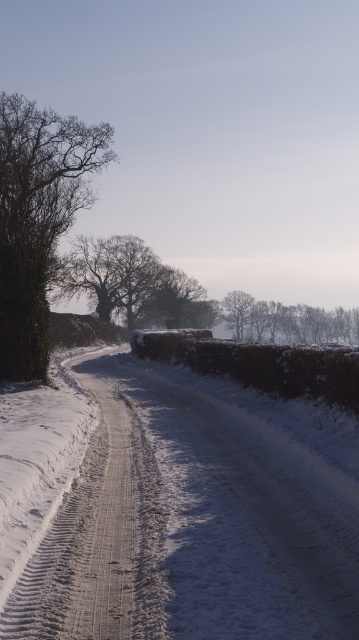
Question: Which object is closer to the camera taking this photo?

Choices:
 (A) green leafy hedge at center
 (B) snowy asphalt road at center

Answer: (B)

Question: Which point is farther from the camera taking this photo?

Choices:
 (A) (338, 349)
 (B) (227, 324)
 (C) (169, 323)
 (D) (59, 148)

Answer: (B)

Question: Can you confirm if bare branches at left is smaller than green leafy hedge at center?

Choices:
 (A) no
 (B) yes

Answer: (A)

Question: Is snowy asphalt road at center to the left of snowy bare trees at center from the viewer's perspective?

Choices:
 (A) yes
 (B) no

Answer: (A)

Question: Is green leafy hedge at center to the right of bare branches at center from the viewer's perspective?

Choices:
 (A) no
 (B) yes

Answer: (B)

Question: Which of the following is the farthest from the observer?

Choices:
 (A) (66, 592)
 (B) (38, 348)
 (C) (254, 324)

Answer: (C)